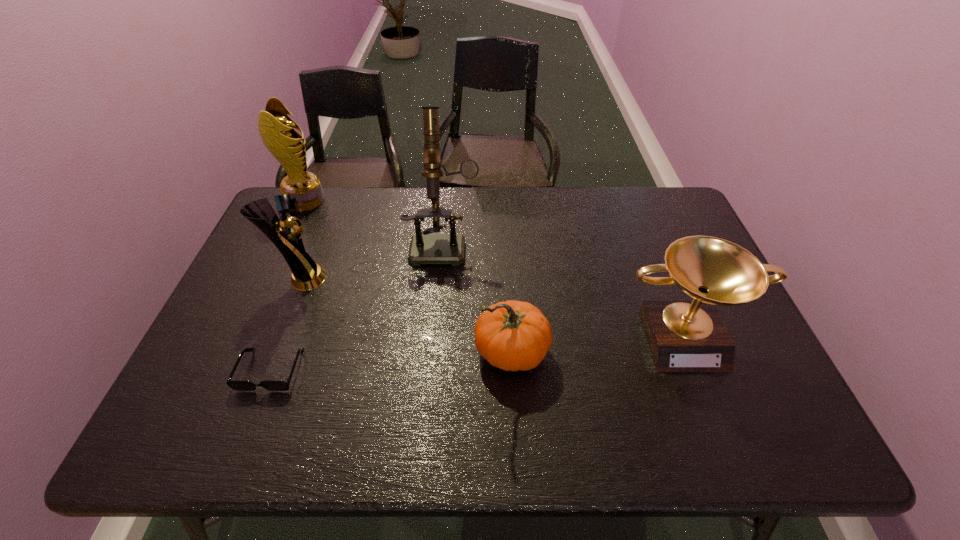
This screenshot has width=960, height=540. Identify the location of microscope. (425, 248).

Identify the location of the farthest object. Image resolution: width=960 pixels, height=540 pixels. (276, 129).

The width and height of the screenshot is (960, 540). What are the coordinates of `the second tallest object` in the screenshot? It's located at (276, 129).

The width and height of the screenshot is (960, 540). Identify the location of the second nearest award. (306, 275).

Where is `pumpkin`? This screenshot has height=540, width=960. pumpkin is located at coordinates (512, 335).

At what (x,y) coordinates should I click in order to perform the action: click on the nearest award. Please return your answer as a coordinate pair (x, y). Looking at the image, I should click on click(x=683, y=336).

Image resolution: width=960 pixels, height=540 pixels. What are the coordinates of `the rightmost object` in the screenshot? It's located at (683, 336).

What are the coordinates of `the shortest object` in the screenshot? It's located at pyautogui.click(x=239, y=385).

At what (x,y) coordinates should I click in order to perform the action: click on vacant space located 0.060m at the eyepiece of the microscope. Please return your answer as a coordinate pair (x, y). This screenshot has height=540, width=960. Looking at the image, I should click on (441, 280).

In order to click on vacant space located 0.330m on the front-facing side of the second tallest object in this screenshot , I will do `click(420, 200)`.